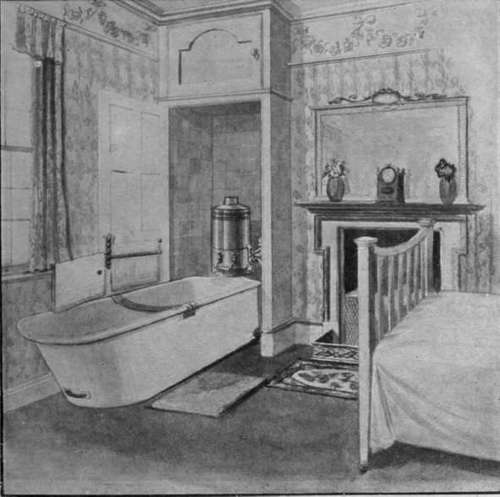
This screenshot has width=500, height=497. In order to click on floor in this screenshot , I will do `click(118, 445)`.